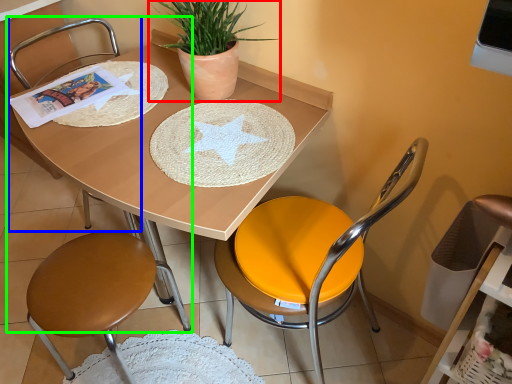
Question: Which is nearer to the houseplant (highlighted by a red box)? armchair (highlighted by a blue box) or chair (highlighted by a green box).

Choices:
 (A) armchair
 (B) chair

Answer: (B)